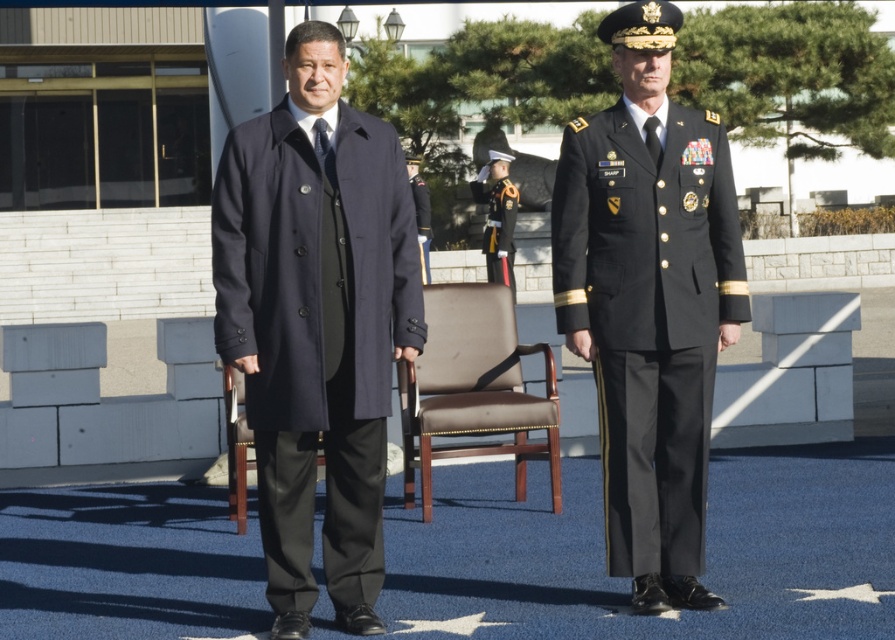
You are attending a formal event and need to sit down. There is a brown leather chair at center and a black glossy uniform at center. Which object should you approach to sit?

The brown leather chair at center is in front of the black glossy uniform at center, so you should approach the brown leather chair at center to sit.

You are attending a formal event and need to sit down. You see a black glossy military uniform at center and a brown leather chair at center. Which object can you sit on?

The brown leather chair at center is the object you can sit on, as the black glossy military uniform at center is positioned over it and likely belongs to a person wearing it.